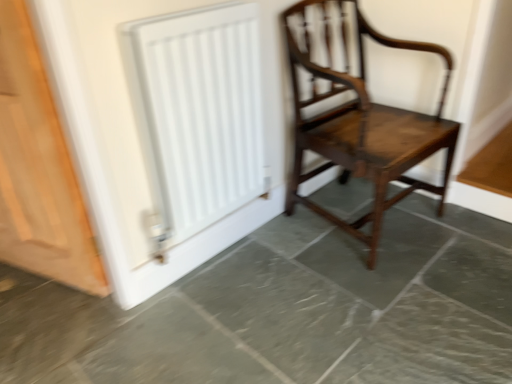
You are a GUI agent. You are given a task and a screenshot of the screen. Output one action in this format:
    pyautogui.click(x=<x>, y=<y>)
    Task: Click on the free space in front of mahogany wooden chair at center
    
    Given the screenshot: What is the action you would take?
    pyautogui.click(x=383, y=301)